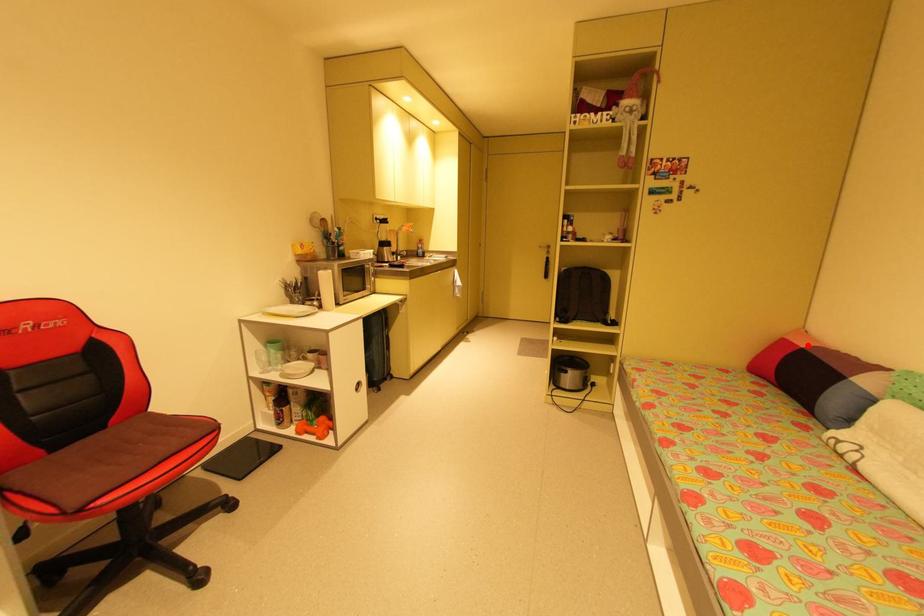
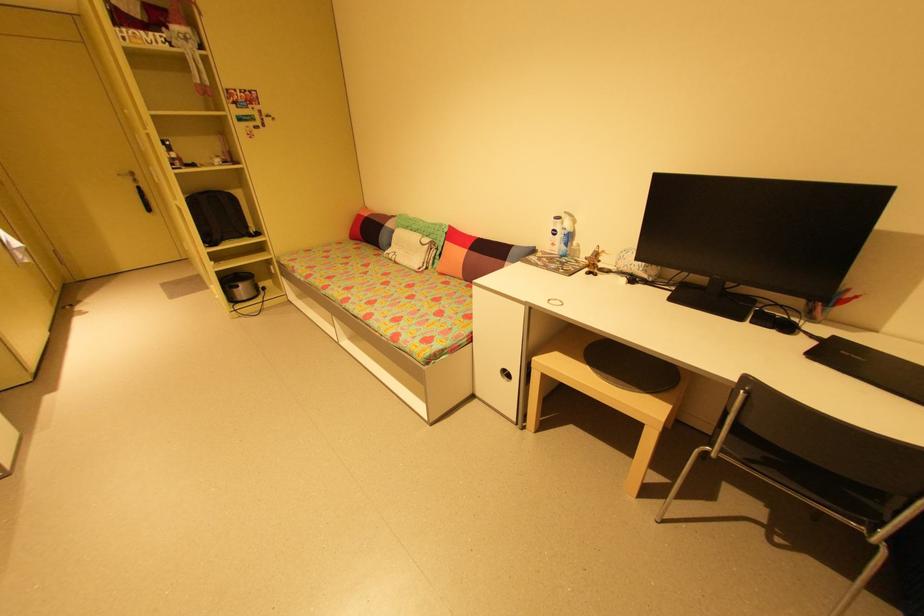
Question: I am providing you with two images of the same scene from different viewpoints. In image1, a red point is highlighted. Considering the same 3D point in image2, which of the following is correct?

Choices:
 (A) It is closer
 (B) It is farther

Answer: (A)